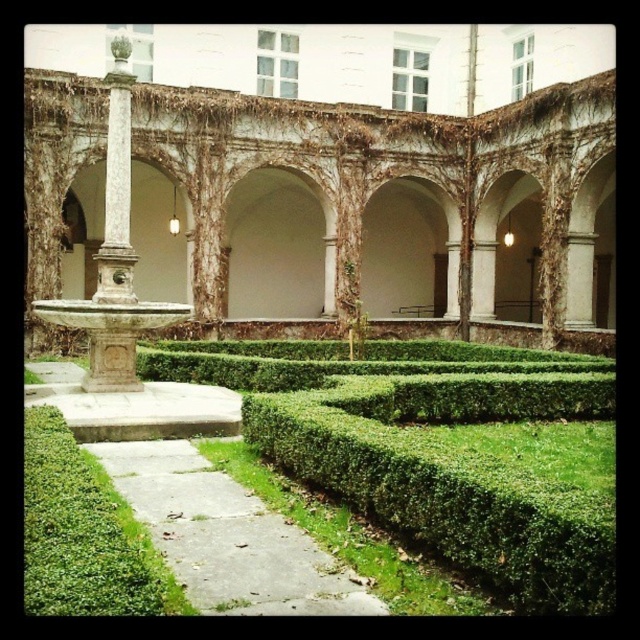
Question: Estimate the real-world distances between objects in this image. Which object is farther from the white stone archway at center?

Choices:
 (A) green hedge at center
 (B) white stone fountain at center

Answer: (A)

Question: Is white stone archway at center above white marble column at center-left?

Choices:
 (A) yes
 (B) no

Answer: (B)

Question: Which object is farther from the camera taking this photo?

Choices:
 (A) white marble column at center-left
 (B) white stone archway at center
 (C) white stone fountain at center
 (D) green hedge at center

Answer: (B)

Question: Does green hedge at center have a lesser width compared to white stone archway at center?

Choices:
 (A) no
 (B) yes

Answer: (A)

Question: Is the position of green hedge at center more distant than that of white stone archway at center?

Choices:
 (A) yes
 (B) no

Answer: (B)

Question: Which of the following is the closest to the observer?

Choices:
 (A) (426, 396)
 (B) (280, 196)

Answer: (A)